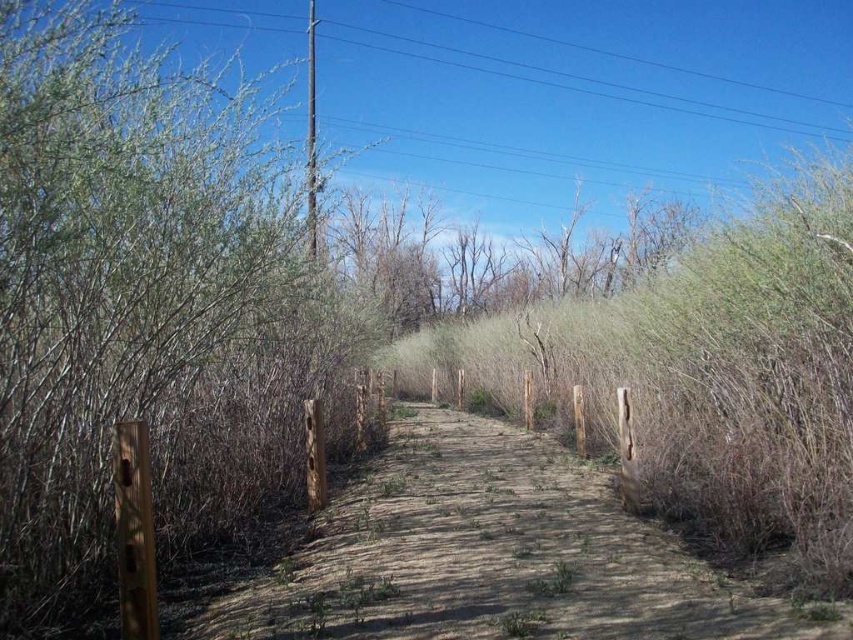
You are a gardener planning to plant a new shrub in this area. You want to choose a spot where the new shrub will have enough space to grow. Based on the current spacing between the green leafy bush at left and the bare branches at center, which location would you recommend for the new shrub?

The green leafy bush at left has a lesser width compared to the bare branches at center, so planting the new shrub near the green leafy bush at left would provide more space for growth since it occupies less area.

You are a hiker who wants to take a photo of the green leafy bush at left and the brown dirt path at center from your current position. Which object will appear larger in your photo?

The green leafy bush at left will appear larger in the photo because it is closer to the viewer than the brown dirt path at center.

You are a gardener planning to water the green leafy bush at left and the brown dirt path at center. Since the path is dry, you want to ensure the water reaches both areas. However, the sprinkler you have can only water one area at a time. Based on their positions, which area should you water first to prevent the water from the second area from affecting the first?

The green leafy bush at left is positioned over the brown dirt path at center. Therefore, you should water the brown dirt path at center first. This way, when you water the green leafy bush at left later, the water might trickle down to the path below, reducing the need for a second watering there.